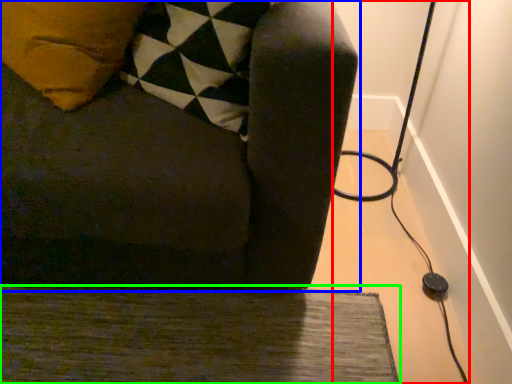
Question: Which is farther away from cable (highlighted by a red box)? furniture (highlighted by a blue box) or doormat (highlighted by a green box)?

Choices:
 (A) furniture
 (B) doormat

Answer: (A)